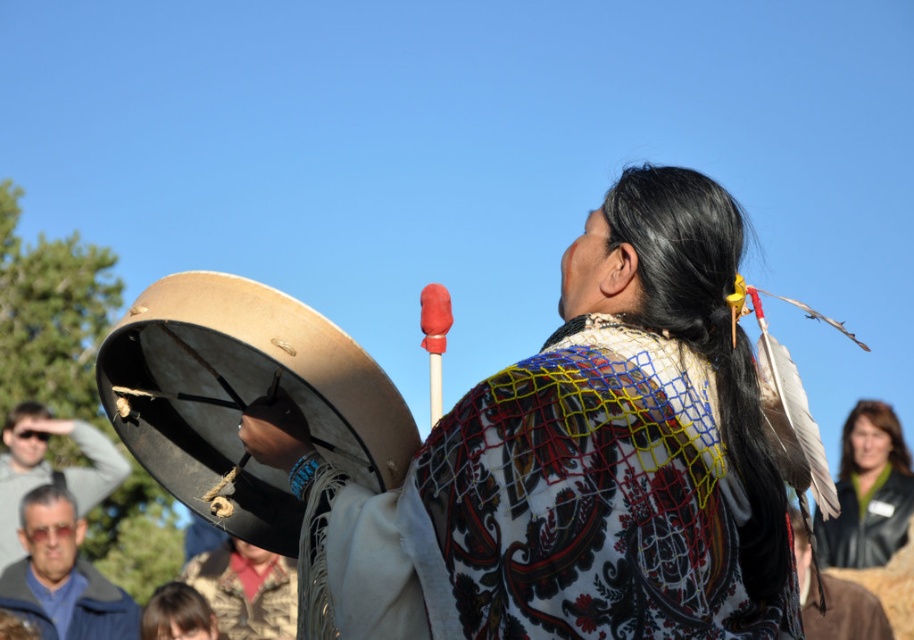
You are a photographer setting up a tripod to capture the scene. You notice the blue denim jacket at lower left and the matte gray sunglasses at lower left. Which object should you focus on first if you want to photograph the smaller one?

The blue denim jacket at lower left is smaller than the matte gray sunglasses at lower left, so you should focus on the blue denim jacket at lower left first.